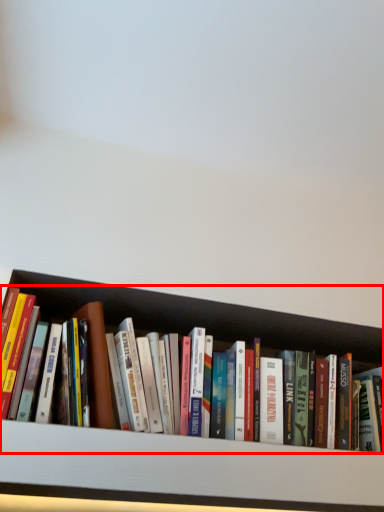
Question: From the image's perspective, where is book (annotated by the red box) located relative to cabinet?

Choices:
 (A) above
 (B) below

Answer: (A)